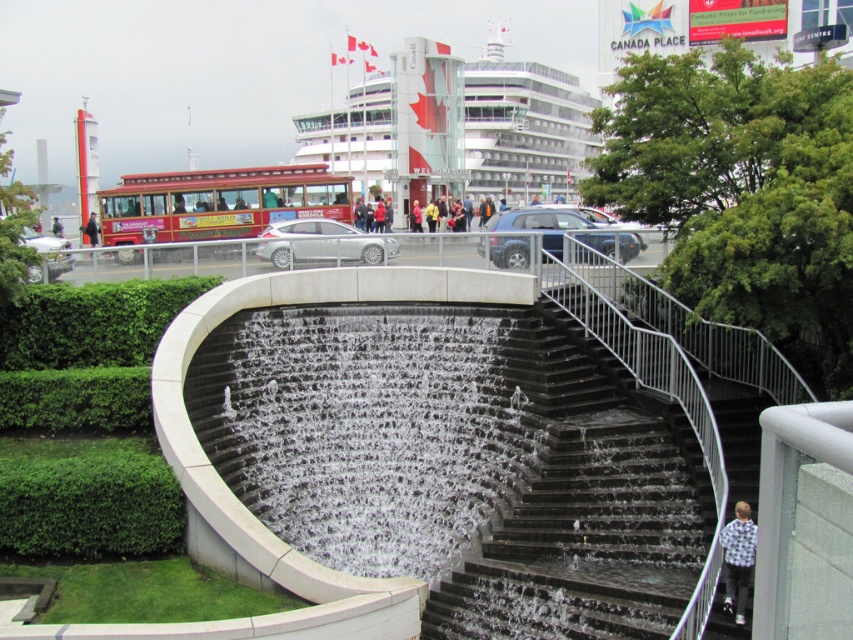
Question: Among these objects, which one is nearest to the camera?

Choices:
 (A) black polished stone stairs at center
 (B) dark blue jacket at center

Answer: (A)

Question: Which of the following is the farthest from the observer?

Choices:
 (A) (83, 230)
 (B) (537, 612)
 (C) (726, 612)

Answer: (A)

Question: Can you confirm if flannel shirt at lower right is positioned below dark blue jacket at center?

Choices:
 (A) no
 (B) yes

Answer: (B)

Question: Is flannel shirt at lower right further to the viewer compared to dark blue jacket at center?

Choices:
 (A) no
 (B) yes

Answer: (A)

Question: Is black polished stone stairs at center above flannel shirt at lower right?

Choices:
 (A) yes
 (B) no

Answer: (A)

Question: Which object appears closest to the camera in this image?

Choices:
 (A) black polished stone stairs at center
 (B) dark blue jacket at center

Answer: (A)